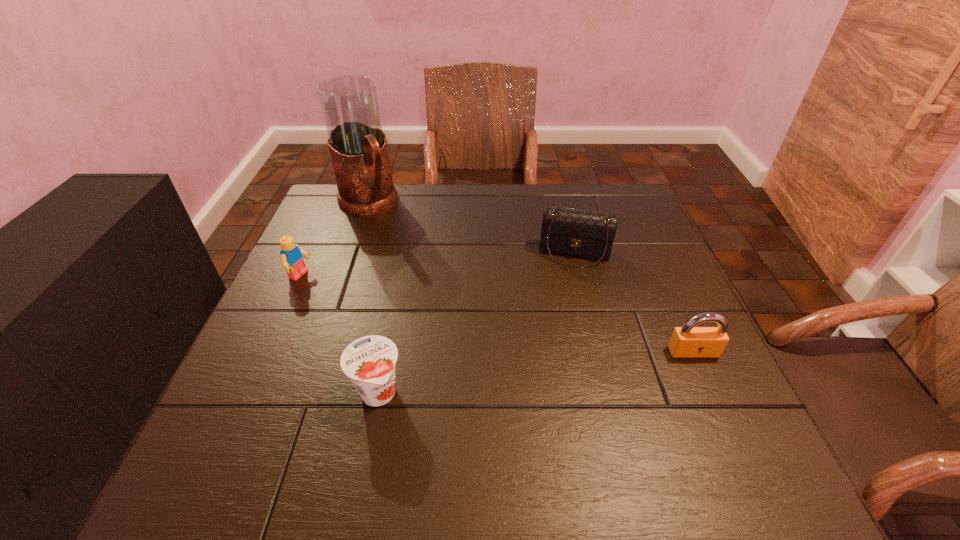
At what (x,y) coordinates should I click in order to perform the action: click on the third object from right to left. Please return your answer as a coordinate pair (x, y). This screenshot has height=540, width=960. Looking at the image, I should click on tap(369, 361).

Image resolution: width=960 pixels, height=540 pixels. What are the coordinates of `yogurt` in the screenshot? It's located at (369, 361).

You are a GUI agent. You are given a task and a screenshot of the screen. Output one action in this format:
    pyautogui.click(x=<x>, y=<y>)
    Task: Click on the rightmost object
    The image size is (960, 540).
    Given the screenshot: What is the action you would take?
    pyautogui.click(x=688, y=341)

Where is `the fourth farthest object`? Image resolution: width=960 pixels, height=540 pixels. the fourth farthest object is located at coordinates (688, 341).

Where is `the farthest object`? The height and width of the screenshot is (540, 960). the farthest object is located at coordinates (357, 144).

This screenshot has height=540, width=960. I want to click on the tallest object, so click(357, 144).

In order to click on clutch bag in this screenshot , I will do `click(581, 233)`.

In order to click on Lego in this screenshot , I will do `click(291, 259)`.

Image resolution: width=960 pixels, height=540 pixels. Find the location of `vacant position located 0.210m on the left of the nearest object`. vacant position located 0.210m on the left of the nearest object is located at coordinates (240, 394).

I want to click on vacant space located 0.100m to unlock the padlock from the front, so [x=715, y=402].